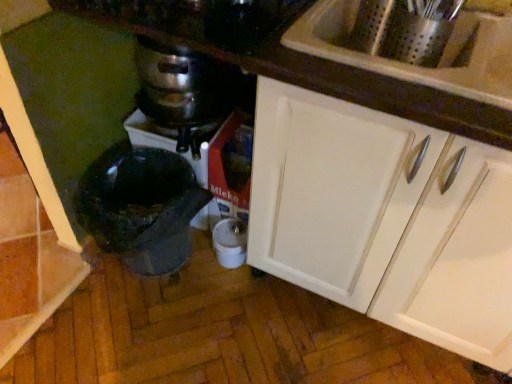
Locate an element on the screen. free space underneath black matte mortar at lower left, placed as the 1th appliance when sorted from left to right (from a real-world perspective) is located at coordinates (162, 269).